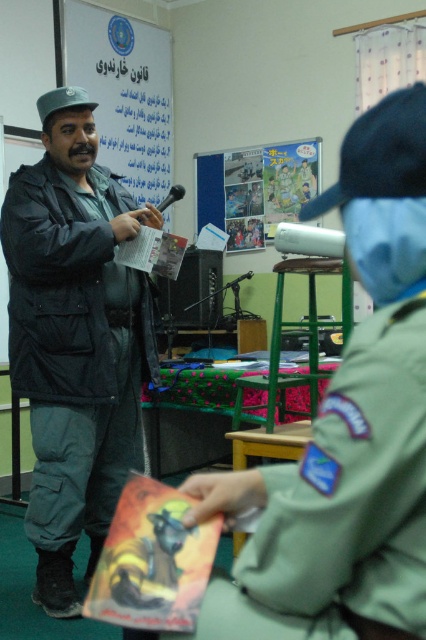
Is green uniform at center smaller than dark green uniform at center?

Indeed, green uniform at center has a smaller size compared to dark green uniform at center.

Looking at this image, which is below, green uniform at center or dark green uniform at center?

dark green uniform at center

Does point (339, 621) lie in front of point (69, 259)?

Yes, point (339, 621) is closer to viewer.

You are a GUI agent. You are given a task and a screenshot of the screen. Output one action in this format:
    pyautogui.click(x=<x>, y=<y>)
    Task: Click on the green uniform at center
    This screenshot has width=426, height=640.
    Given the screenshot: What is the action you would take?
    pyautogui.click(x=347, y=429)

Does green uniform at center appear on the right side of white matte poster at upper center?

Yes, green uniform at center is to the right of white matte poster at upper center.

Which is in front, point (247, 605) or point (74, 22)?

Point (247, 605) is more forward.

Locate an element on the screen. green uniform at center is located at coordinates (347, 429).

Who is taller, dark green uniform at center or white matte poster at upper center?

With more height is dark green uniform at center.

Between point (112, 264) and point (134, 150), which one is positioned in front?

Point (112, 264) is more forward.

Image resolution: width=426 pixels, height=640 pixels. I want to click on dark green uniform at center, so click(x=74, y=339).